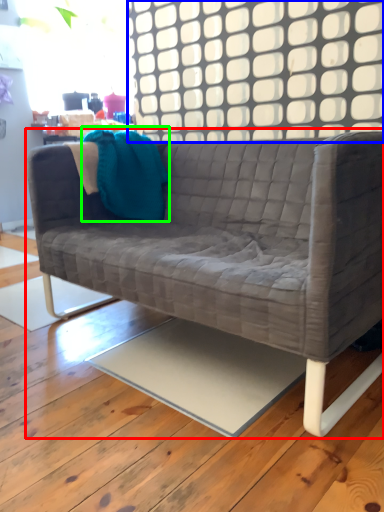
Question: Which object is positioned closest to studio couch (highlighted by a red box)? Select from window (highlighted by a blue box) and throw pillow (highlighted by a green box).

Choices:
 (A) window
 (B) throw pillow

Answer: (B)